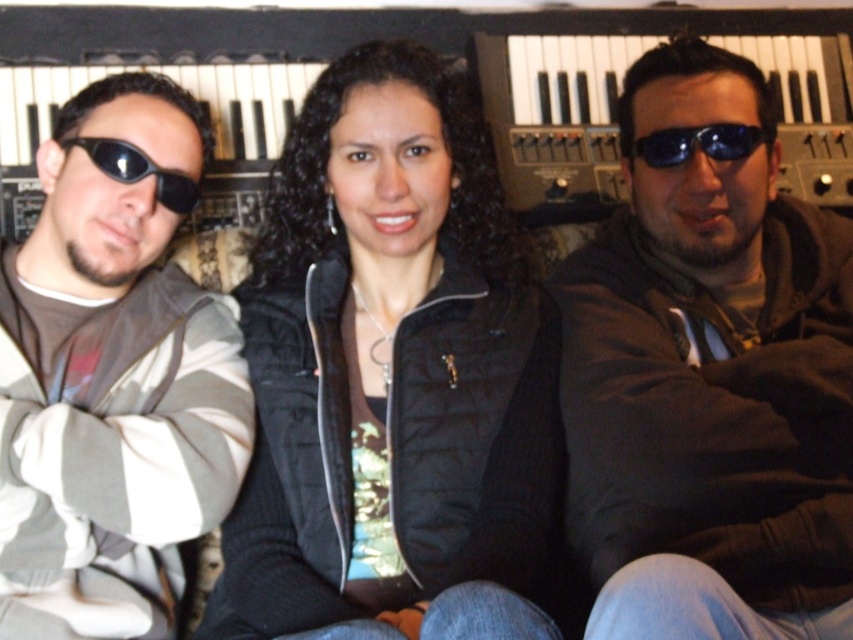
Question: Which is farther from the black plastic sunglasses at center?

Choices:
 (A) black quilted vest at center
 (B) metallic keyboard at upper center

Answer: (B)

Question: Does black plastic keyboard at center appear under black matte sunglasses at left?

Choices:
 (A) yes
 (B) no

Answer: (B)

Question: Is metallic keyboard at upper center thinner than black plastic sunglasses at center?

Choices:
 (A) yes
 (B) no

Answer: (B)

Question: Is metallic keyboard at upper center further to the viewer compared to black plastic keyboard at center?

Choices:
 (A) yes
 (B) no

Answer: (B)

Question: Which point is closer to the camera?

Choices:
 (A) (646, 164)
 (B) (613, 570)

Answer: (B)

Question: Which point is closer to the camera?

Choices:
 (A) (595, 157)
 (B) (80, 474)

Answer: (B)